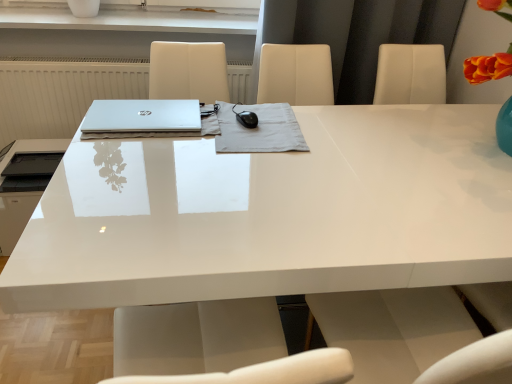
Locate an element on the screen. free space between sleek silver laptop at center and satin black mouse at center is located at coordinates (173, 139).